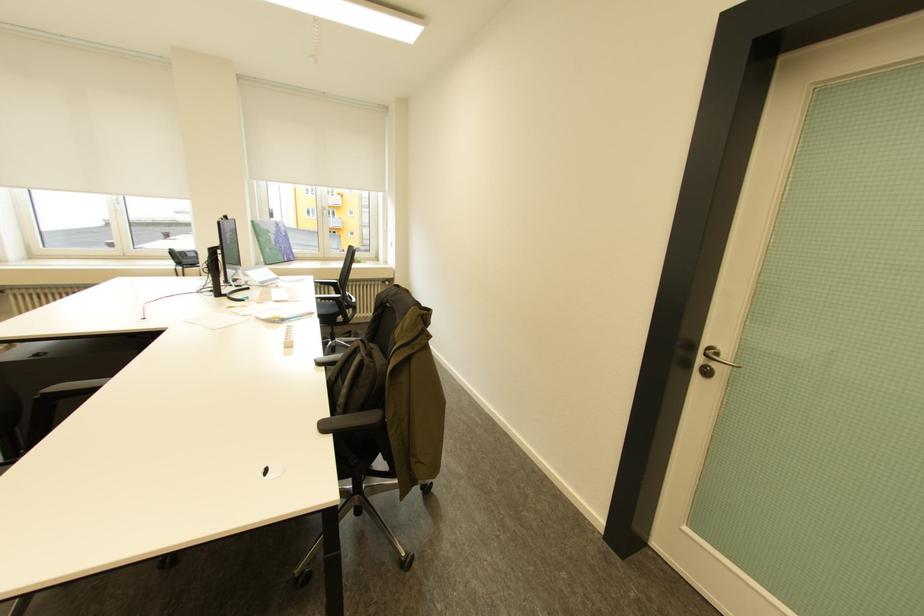
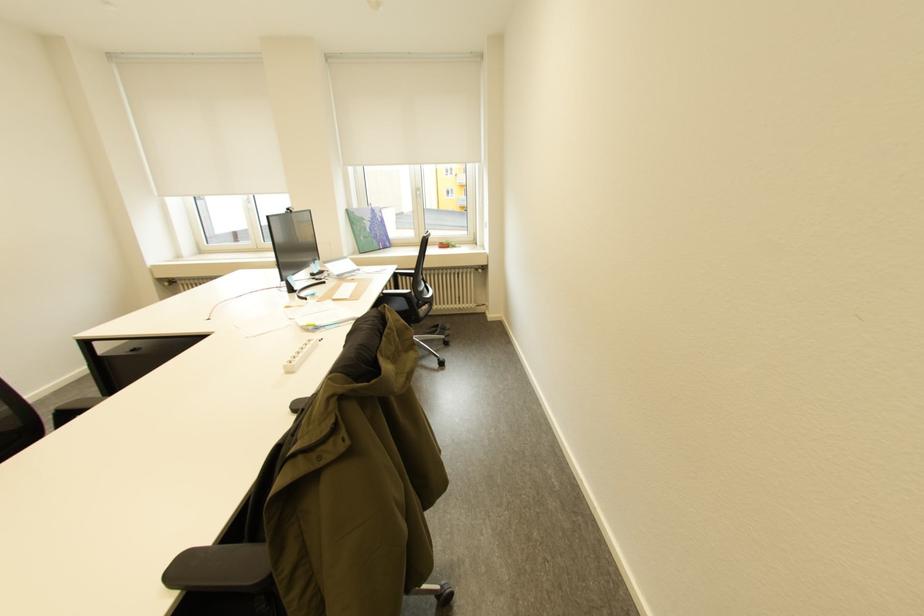
Question: The images are taken continuously from a first-person perspective. In which direction is your viewpoint rotating?

Choices:
 (A) Left
 (B) Right
 (C) Up
 (D) Down

Answer: (A)